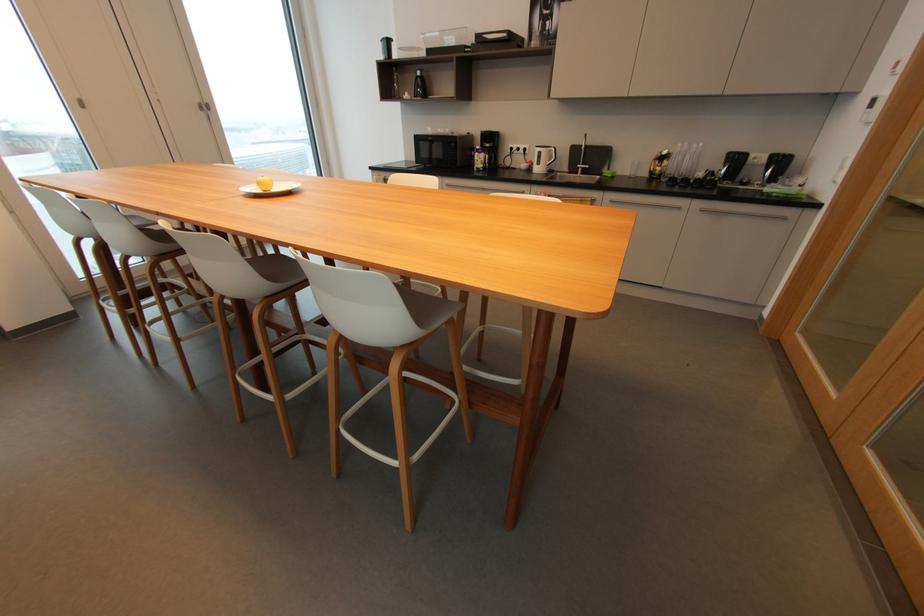
The height and width of the screenshot is (616, 924). Find the location of `white door handle`. white door handle is located at coordinates (81, 103).